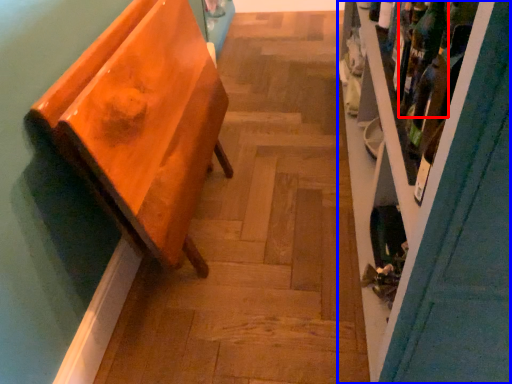
Question: Which point is further to the camera, wine bottle (highlighted by a red box) or shelf (highlighted by a blue box)?

Choices:
 (A) wine bottle
 (B) shelf

Answer: (A)